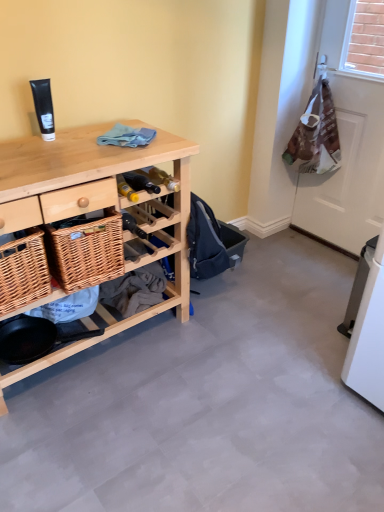
Image resolution: width=384 pixels, height=512 pixels. I want to click on vacant space to the left of blue cotton cloth at center, so click(x=84, y=138).